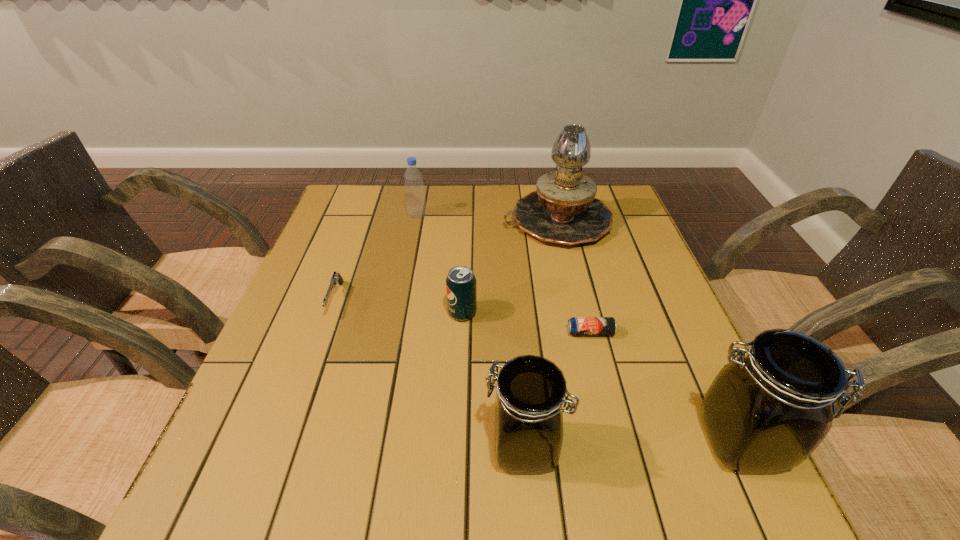
Find the location of `bottle present at the far edge`. bottle present at the far edge is located at coordinates (415, 197).

You are a GUI agent. You are given a task and a screenshot of the screen. Output one action in this format:
    pyautogui.click(x=<x>, y=<y>)
    Task: Click on the object positioned at the left edge
    
    Given the screenshot: What is the action you would take?
    pyautogui.click(x=336, y=279)

The image size is (960, 540). In order to click on jar at the right edge in this screenshot , I will do `click(766, 412)`.

Where is `oil lamp located in the right edge section of the desktop`? Image resolution: width=960 pixels, height=540 pixels. oil lamp located in the right edge section of the desktop is located at coordinates (563, 210).

Locate an element on the screen. beer can located at the right edge is located at coordinates (577, 326).

I want to click on object positioned at the far right corner, so click(x=563, y=210).

The image size is (960, 540). In order to click on object that is at the near right corner in this screenshot , I will do coord(766,412).

In the image, there is a desktop. Identify the location of vacant space at the far edge. Image resolution: width=960 pixels, height=540 pixels. (432, 184).

Locate an element on the screen. This screenshot has width=960, height=540. free region at the left edge of the desktop is located at coordinates (309, 403).

Identify the location of free region at the right edge of the desktop. [622, 315].